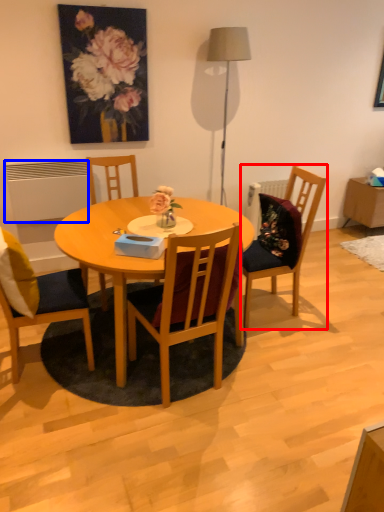
Question: Which point is further to the camera, chair (highlighted by a red box) or radiator (highlighted by a blue box)?

Choices:
 (A) chair
 (B) radiator

Answer: (B)